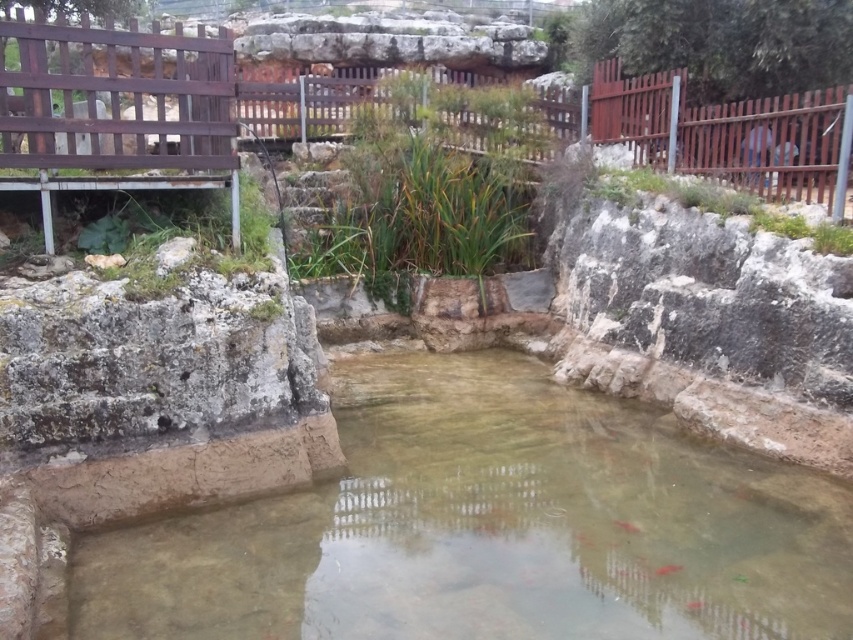
Between smooth stone pond at center and translucent pink fish at center, which one has less height?

Standing shorter between the two is translucent pink fish at center.

Can you confirm if smooth stone pond at center is shorter than translucent pink fish at center?

No.

What do you see at coordinates (489, 528) in the screenshot? I see `smooth stone pond at center` at bounding box center [489, 528].

Locate an element on the screen. smooth stone pond at center is located at coordinates (489, 528).

Does translucent pink fish at center appear on the left side of shiny orange fish at center?

Yes, translucent pink fish at center is to the left of shiny orange fish at center.

Does translucent pink fish at center have a larger size compared to shiny orange fish at center?

Yes.

Describe the element at coordinates (625, 525) in the screenshot. The width and height of the screenshot is (853, 640). I see `translucent pink fish at center` at that location.

The width and height of the screenshot is (853, 640). I want to click on translucent pink fish at center, so click(x=625, y=525).

Is point (712, 593) less distant than point (662, 566)?

Yes, point (712, 593) is closer to viewer.

Image resolution: width=853 pixels, height=640 pixels. What do you see at coordinates (489, 528) in the screenshot?
I see `smooth stone pond at center` at bounding box center [489, 528].

The image size is (853, 640). I want to click on smooth stone pond at center, so pyautogui.click(x=489, y=528).